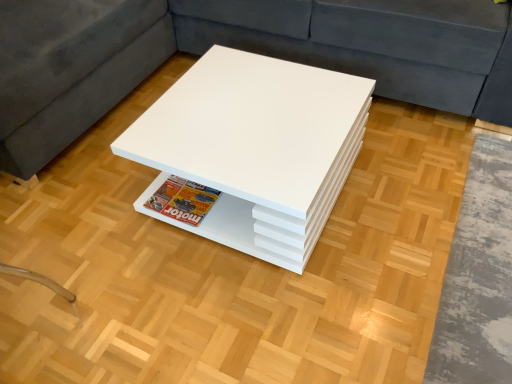
The height and width of the screenshot is (384, 512). What are the coordinates of `white glossy table at center` in the screenshot? It's located at (255, 148).

What do you see at coordinates (255, 148) in the screenshot?
I see `white glossy table at center` at bounding box center [255, 148].

This screenshot has height=384, width=512. Identify the location of white glossy table at center. (255, 148).